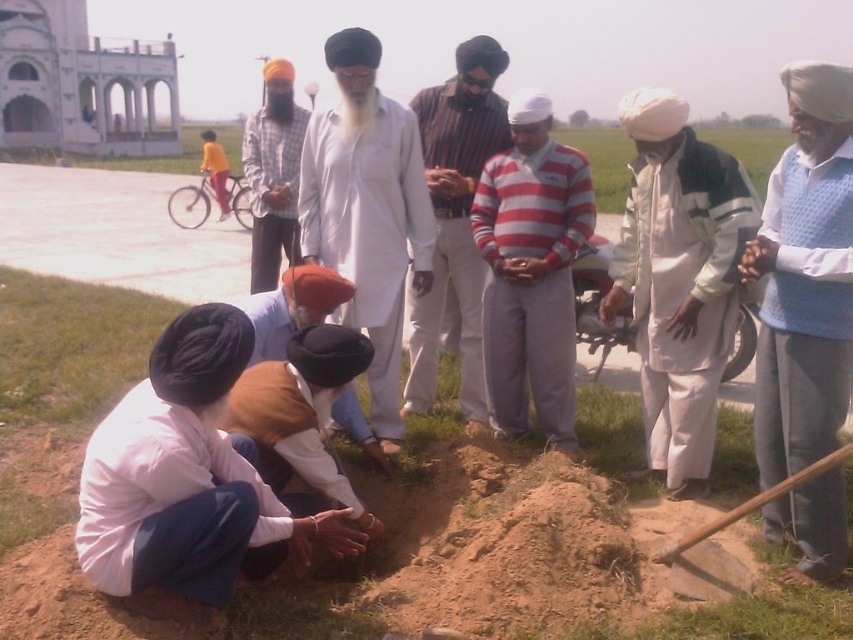
The width and height of the screenshot is (853, 640). Describe the element at coordinates (805, 276) in the screenshot. I see `white dotted shirt at center` at that location.

Is point (849, 234) behind point (381, 456)?

That is False.

Between point (839, 148) and point (262, 317), which one is positioned behind?

Positioned behind is point (262, 317).

At what (x,y) coordinates should I click in order to perform the action: click on white dotted shirt at center. Please return your answer as a coordinate pair (x, y). The image size is (853, 640). Looking at the image, I should click on (805, 276).

Does point (100, 513) lie in front of point (251, 573)?

Yes, it is.

Which is above, light pink fabric at lower left or brown fabric turban at lower center?

Positioned higher is brown fabric turban at lower center.

Who is more forward, (200, 480) or (277, 476)?

Positioned in front is point (200, 480).

Locate an element on the screen. The width and height of the screenshot is (853, 640). light pink fabric at lower left is located at coordinates (189, 477).

Does striped cotton sweater at center appear on the left side of matte white turban at center?

In fact, striped cotton sweater at center is to the right of matte white turban at center.

Between striped cotton sweater at center and matte white turban at center, which one appears on the right side from the viewer's perspective?

From the viewer's perspective, striped cotton sweater at center appears more on the right side.

Is point (503, 330) closer to camera compared to point (293, 115)?

Yes.

Where is `striped cotton sweater at center`? This screenshot has width=853, height=640. striped cotton sweater at center is located at coordinates (531, 272).